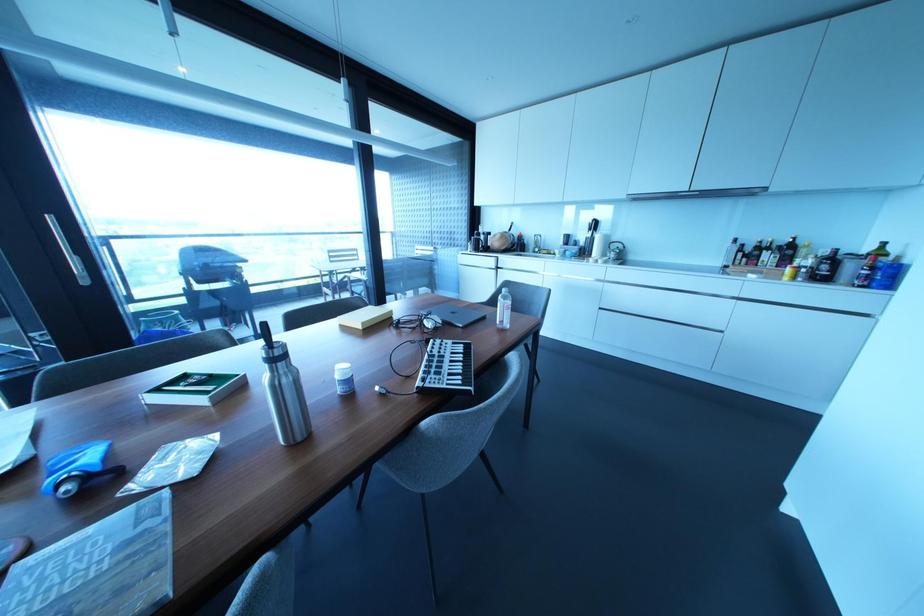
This screenshot has width=924, height=616. What are the coordinates of `clear plastic bottle` in the screenshot? It's located at (284, 391).